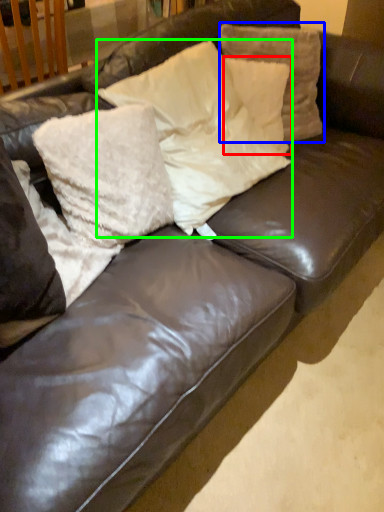
Question: Which object is the farthest from pillow (highlighted by a red box)? Choose among these: pillow (highlighted by a blue box) or pillow (highlighted by a green box).

Choices:
 (A) pillow
 (B) pillow

Answer: (B)